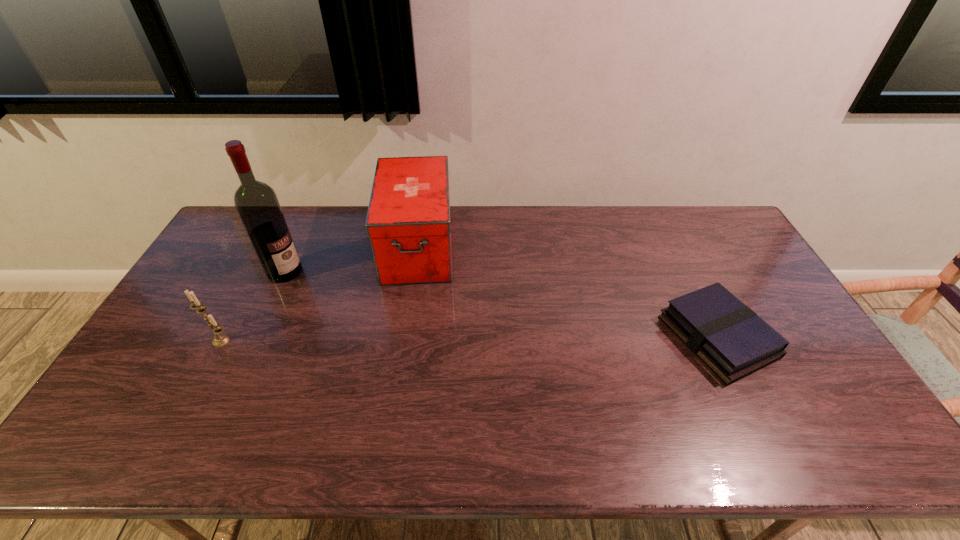
I want to click on vacant space located 0.260m on the handle side of the second object from right to left, so click(411, 354).

Locate an element on the screen. This screenshot has width=960, height=540. vacant area located 0.270m on the front and back of the tallest object is located at coordinates (357, 312).

I want to click on free location located 0.150m on the front and back of the tallest object, so click(329, 296).

This screenshot has width=960, height=540. I want to click on vacant space situated 0.400m on the front and back of the tallest object, so click(x=390, y=330).

The height and width of the screenshot is (540, 960). What are the coordinates of `object that is at the far edge` in the screenshot? It's located at (408, 223).

I want to click on object that is at the near edge, so [731, 339].

The width and height of the screenshot is (960, 540). I want to click on object situated at the left edge, so click(219, 340).

The image size is (960, 540). Find the location of `object that is at the right edge`. object that is at the right edge is located at coordinates (731, 339).

Find the location of `object at the near right corner`. object at the near right corner is located at coordinates (731, 339).

At what (x,y) coordinates should I click in order to perform the action: click on vacant space at the far edge of the desktop. Please return your answer as a coordinate pair (x, y). This screenshot has width=960, height=540. Looking at the image, I should click on (535, 241).